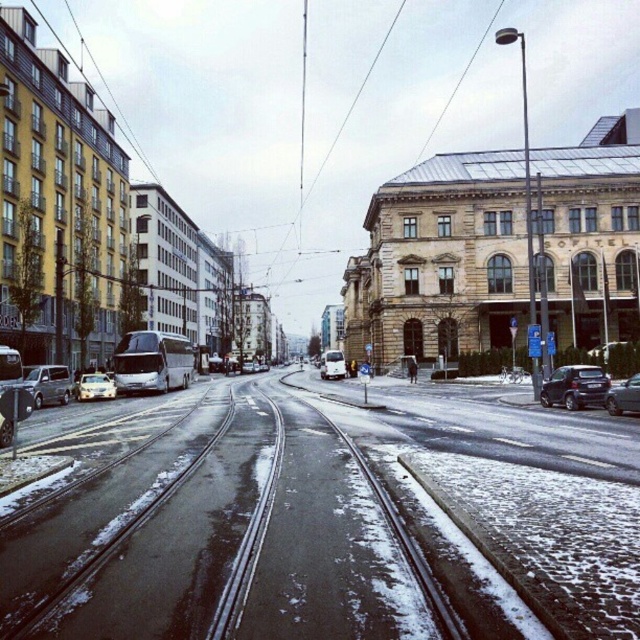
In the scene shown: You are a delivery person needing to park your vehicle in the parking spot at the lower right of the image. The parking spot can only accommodate vehicles that take up less space than the metallic silver sedan at lower right. Do you think your shiny black sedan at lower right will fit?

The shiny black sedan at lower right occupies less space than the metallic silver sedan at lower right, so yes, it will fit in the parking spot.

You are a delivery person with a cart that is 3 meters wide. You need to move through the space between the shiny black sedan at lower right and the metallic silver sedan at lower right. Can your cart fit through the gap between them?

The gap between the shiny black sedan at lower right and the metallic silver sedan at lower right is 2.63 meters, which is narrower than the cart width of 3 meters. Therefore, the cart cannot fit through the gap between them.